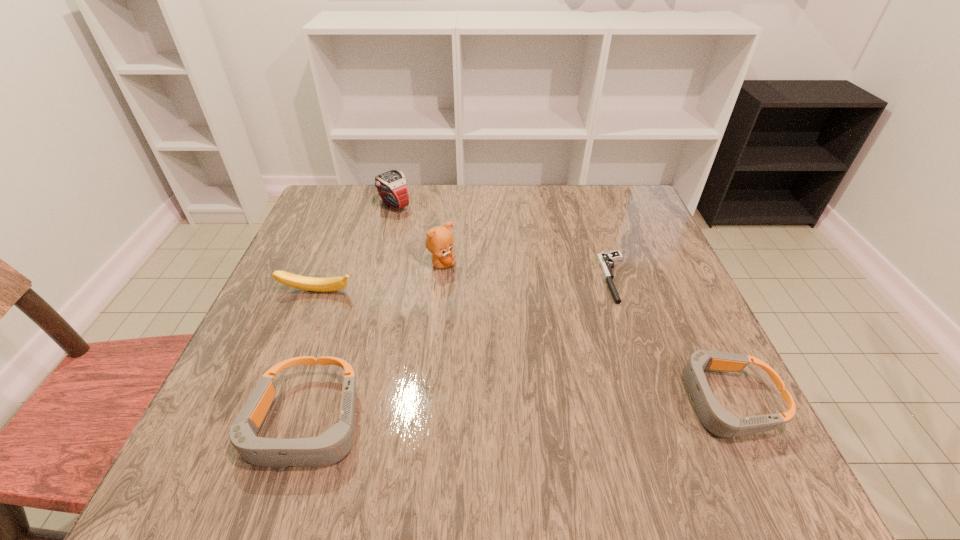
I want to click on vacant space located 0.300m on the front and back of the second shortest object, so [505, 401].

Locate an element on the screen. The width and height of the screenshot is (960, 540). blank space located 0.370m on the front and back of the second shortest object is located at coordinates (466, 401).

This screenshot has width=960, height=540. What are the coordinates of `vacant space located on the front and back of the second shortest object` in the screenshot? It's located at (608, 401).

Identify the location of free space located on the front of the farthest object. The height and width of the screenshot is (540, 960). (372, 289).

This screenshot has height=540, width=960. In order to click on vacant space situated 0.350m on the face of the teddy bear in this screenshot , I will do `click(603, 264)`.

This screenshot has width=960, height=540. Find the location of `vacant position located 0.360m on the front-facing side of the shortest object`. vacant position located 0.360m on the front-facing side of the shortest object is located at coordinates (445, 278).

The width and height of the screenshot is (960, 540). What are the coordinates of `free space located on the front-facing side of the shortest object` in the screenshot? It's located at (502, 278).

The image size is (960, 540). In order to click on free region located on the front-facing side of the shortest object in this screenshot , I will do `click(550, 278)`.

The image size is (960, 540). Identify the location of free location located at the stem of the banana. (272, 407).

Locate an element on the screen. The image size is (960, 540). object located at the far edge is located at coordinates (392, 186).